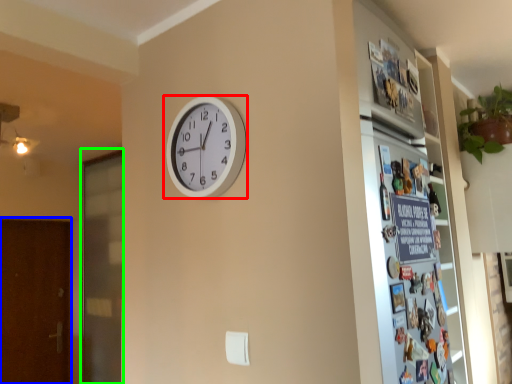
Question: Considering the real-world distances, which object is farthest from wall clock (highlighted by a red box)? screen door (highlighted by a blue box) or screen door (highlighted by a green box)?

Choices:
 (A) screen door
 (B) screen door

Answer: (A)